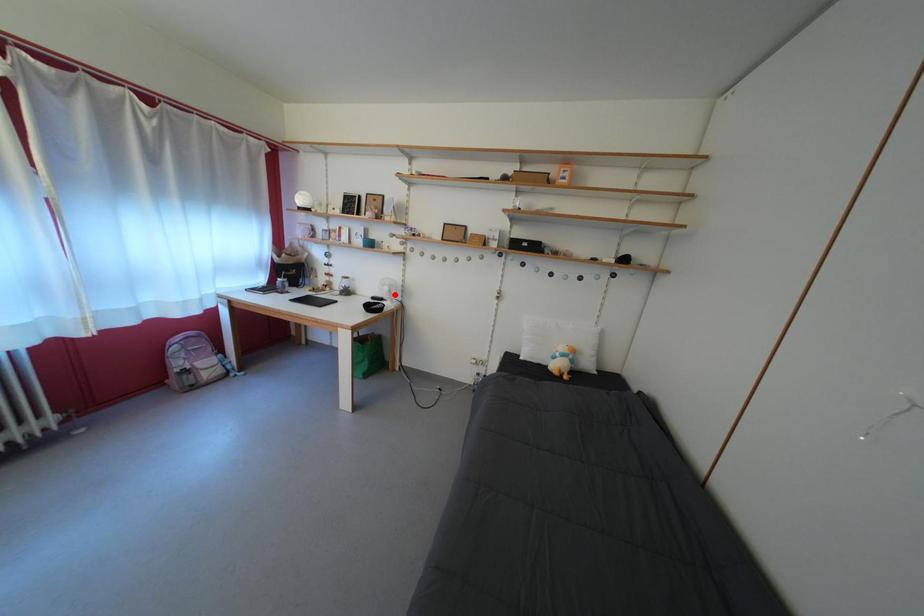
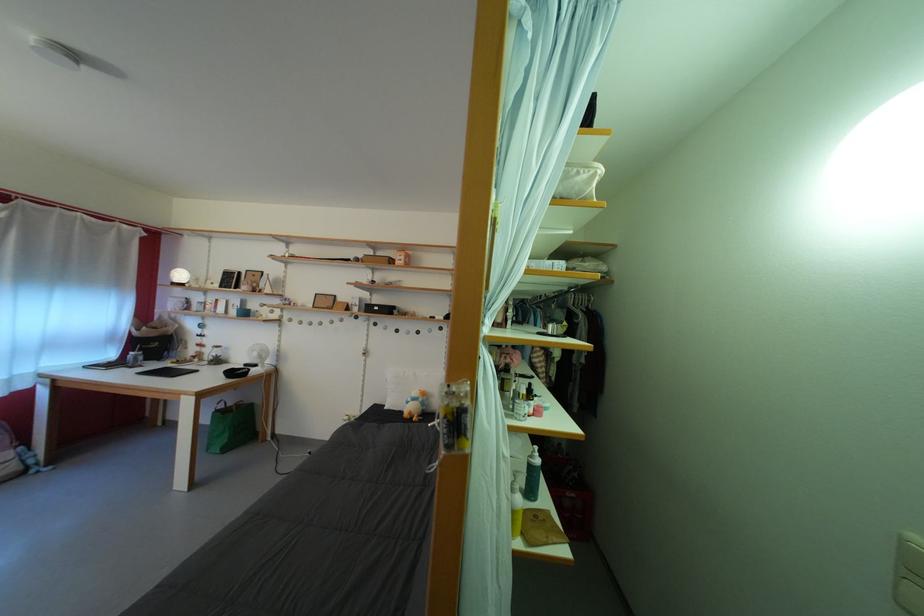
The point at the highlighted location is marked in the first image. Where is the corresponding point in the second image?

(263, 360)